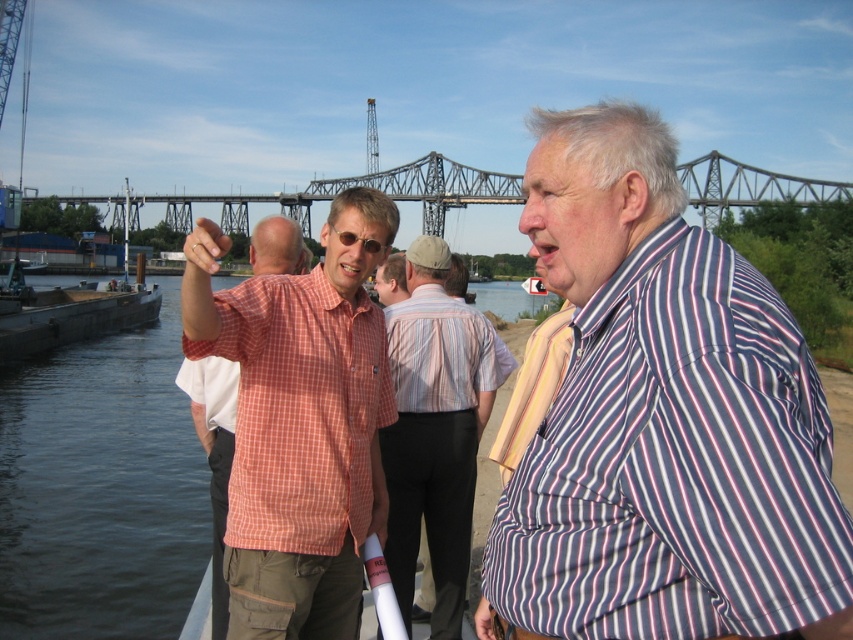
You are a photographer standing in front of the striped cotton shirt at center and the metallic gray bridge at upper center. You want to take a photo that includes both subjects. Which one should you focus on first to ensure both are in sharp focus?

You should focus on the striped cotton shirt at center first because it is closer to the viewer than the metallic gray bridge at upper center. By focusing on the closer subject, the bridge will still be within the depth of field and remain sharp.

You are a photographer standing behind the two men in the scene. You want to capture a photo where both the checkered fabric shirt at center and the striped cotton shirt at center are visible. Based on their positions, which shirt should you focus on first to ensure both are in frame?

The checkered fabric shirt at center is above the striped cotton shirt at center, so you should focus on the checkered fabric shirt at center first to ensure both are in frame.